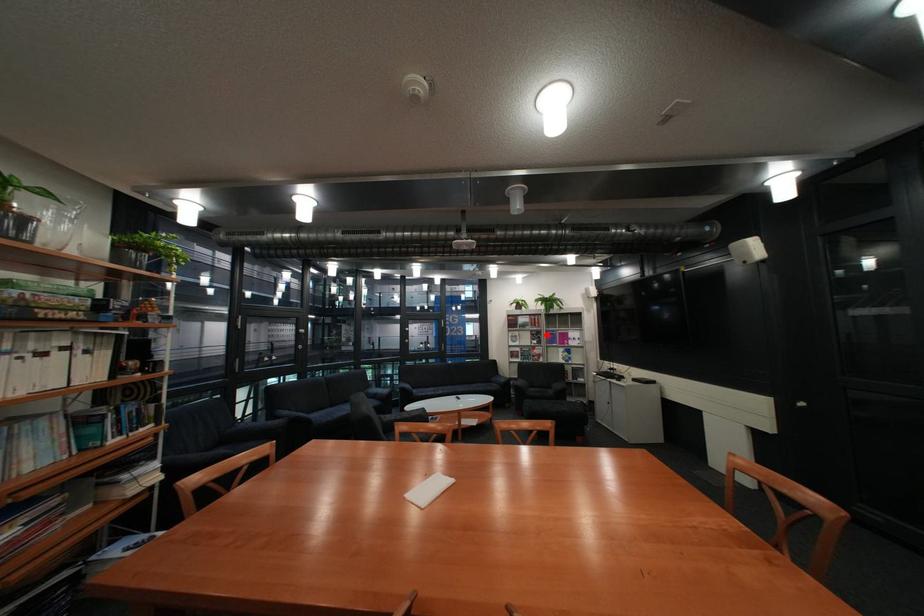
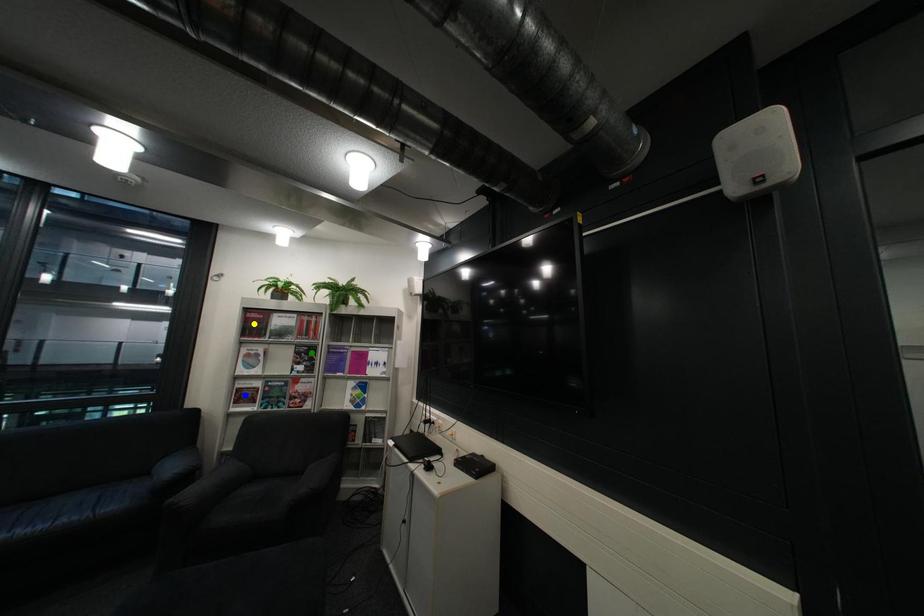
Question: I am providing you with two images of the same scene from different viewpoints. A red point is marked on the first image. You are given multiple points on the second image. Which point in image 2 represents the same 3d spot as the red point in image 1?

Choices:
 (A) yellow point
 (B) blue point
 (C) green point

Answer: (C)